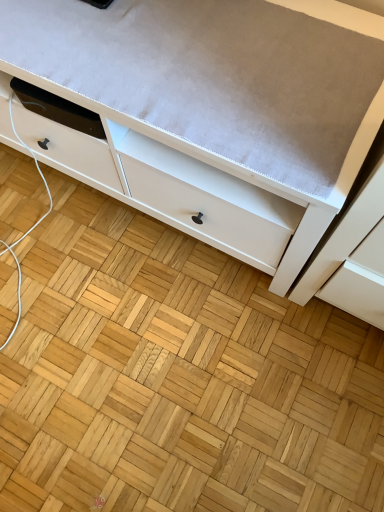
Identify the location of free space above white matte chest of drawers at center (from a real-world perspective). (184, 49).